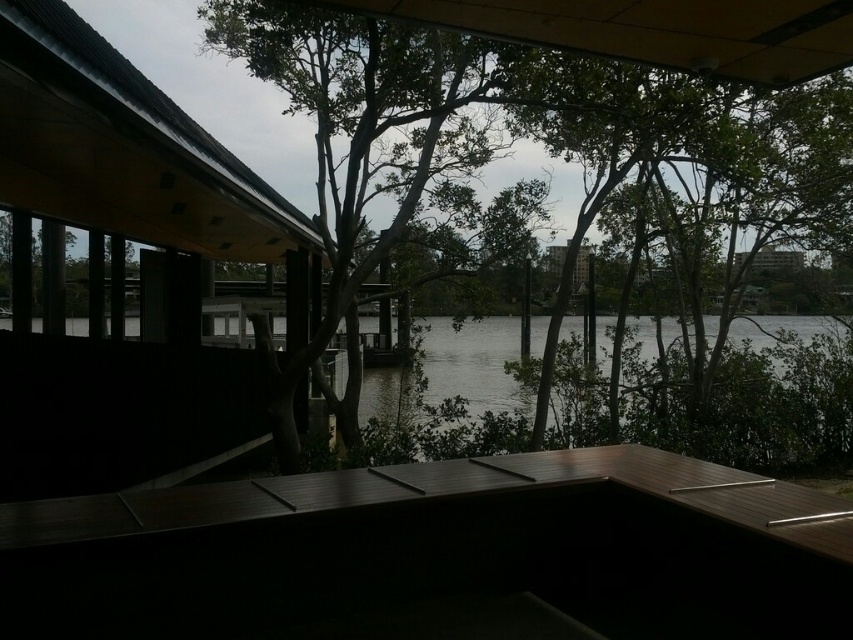
Can you confirm if dark wood deck at center is bigger than gray water at center?

Indeed, dark wood deck at center has a larger size compared to gray water at center.

Can you confirm if dark wood deck at center is positioned above gray water at center?

Incorrect, dark wood deck at center is not positioned above gray water at center.

Which is in front, point (149, 520) or point (453, 387)?

Positioned in front is point (149, 520).

The image size is (853, 640). I want to click on dark wood deck at center, so click(x=439, y=554).

From the picture: Which of these two, dark wood deck at center or green leafy tree at center, stands shorter?

green leafy tree at center is shorter.

Consider the image. Which is below, dark wood deck at center or green leafy tree at center?

dark wood deck at center

You are a GUI agent. You are given a task and a screenshot of the screen. Output one action in this format:
    pyautogui.click(x=<x>, y=<y>)
    Task: Click on the dark wood deck at center
    
    Given the screenshot: What is the action you would take?
    pyautogui.click(x=439, y=554)

Locate an element on the screen. The image size is (853, 640). dark wood deck at center is located at coordinates (439, 554).

Does green leafy tree at center appear on the right side of gray water at center?

Yes, green leafy tree at center is to the right of gray water at center.

Is point (453, 36) closer to viewer compared to point (483, 371)?

That is True.

Which is behind, point (619, 22) or point (502, 385)?

Positioned behind is point (502, 385).

This screenshot has width=853, height=640. Identify the location of green leafy tree at center. (486, 93).